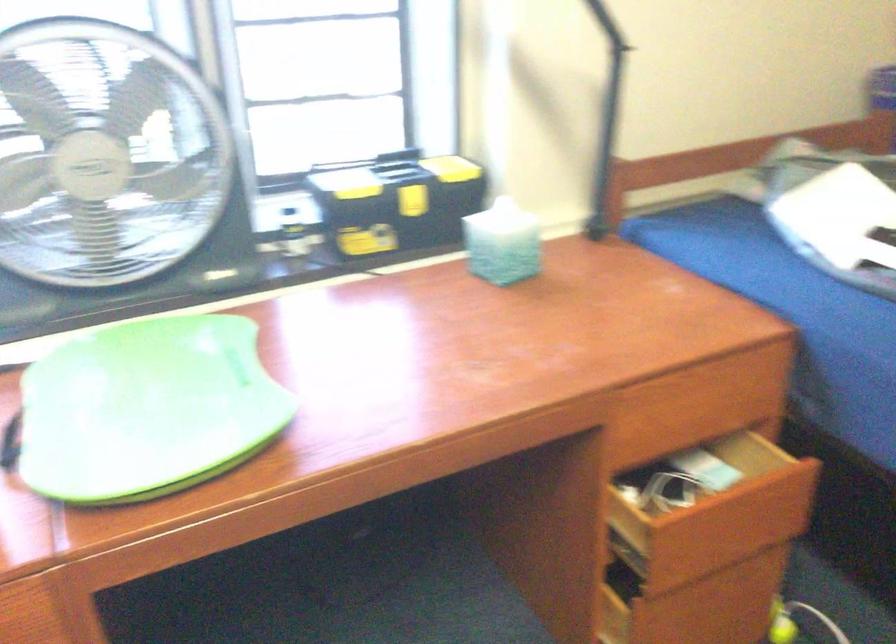
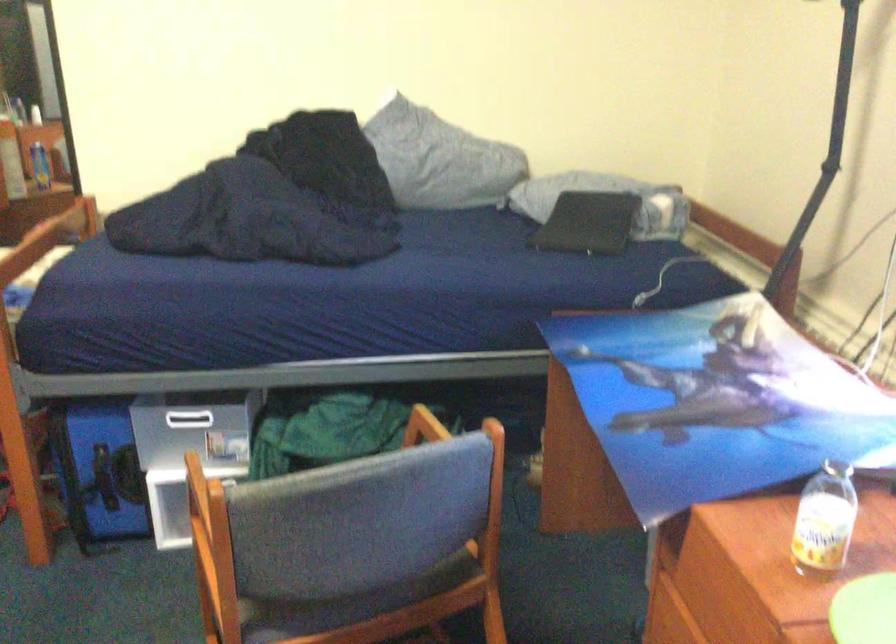
How did the camera likely rotate?

The camera's rotation is toward left-down.